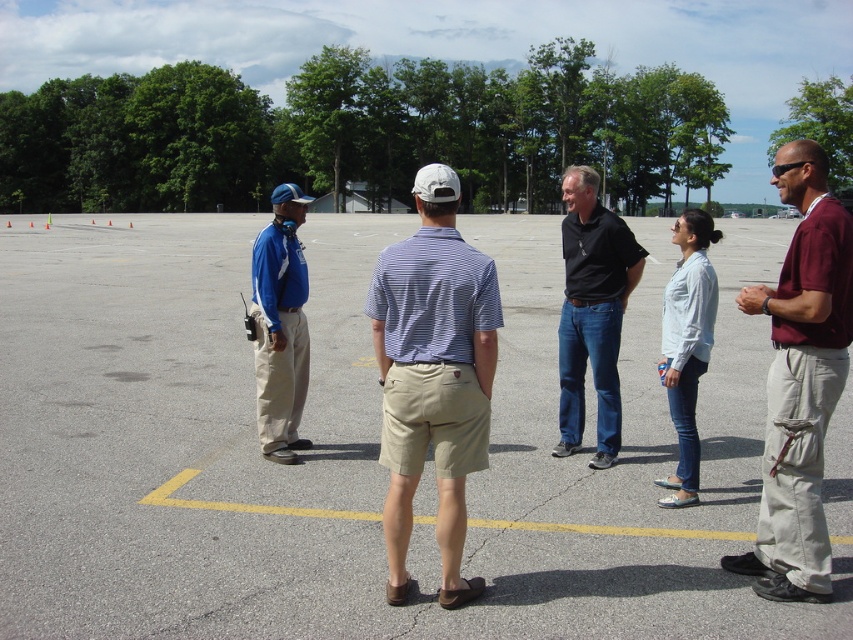
Who is taller, gray asphalt parking lot at center or khaki shorts at center?

With more height is gray asphalt parking lot at center.

Is gray asphalt parking lot at center smaller than khaki shorts at center?

No, gray asphalt parking lot at center is not smaller than khaki shorts at center.

You are a GUI agent. You are given a task and a screenshot of the screen. Output one action in this format:
    pyautogui.click(x=<x>, y=<y>)
    Task: Click on the gray asphalt parking lot at center
    
    Given the screenshot: What is the action you would take?
    pyautogui.click(x=360, y=449)

Where is `gray asphalt parking lot at center`? The width and height of the screenshot is (853, 640). gray asphalt parking lot at center is located at coordinates (360, 449).

Does khaki shorts at center have a greater width compared to matte khaki pants at left?

No, khaki shorts at center is not wider than matte khaki pants at left.

Where is `khaki shorts at center`? This screenshot has height=640, width=853. khaki shorts at center is located at coordinates (433, 374).

Which is more to the left, maroon cotton shirt at right or black cotton shirt at center?

black cotton shirt at center is more to the left.

Does maroon cotton shirt at right have a lesser width compared to black cotton shirt at center?

Incorrect, maroon cotton shirt at right's width is not less than black cotton shirt at center's.

Find the location of a particular element. maroon cotton shirt at right is located at coordinates (799, 380).

You are a GUI agent. You are given a task and a screenshot of the screen. Output one action in this format:
    pyautogui.click(x=<x>, y=<y>)
    Task: Click on the maroon cotton shirt at right
    The image size is (853, 640).
    Given the screenshot: What is the action you would take?
    pyautogui.click(x=799, y=380)